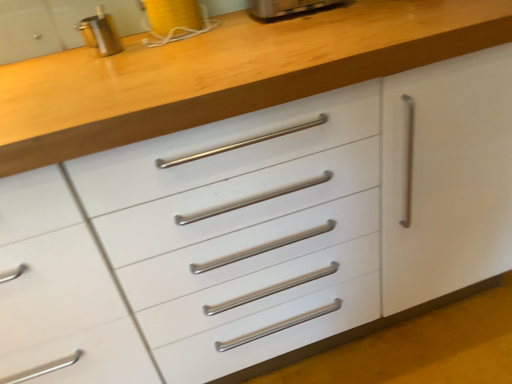
You are a GUI agent. You are given a task and a screenshot of the screen. Output one action in this format:
    pyautogui.click(x=<x>, y=<y>)
    Task: Click on the vacant space situated on the left part of metallic silver canister at upper left
    Image resolution: width=512 pixels, height=384 pixels.
    Given the screenshot: What is the action you would take?
    pyautogui.click(x=50, y=60)